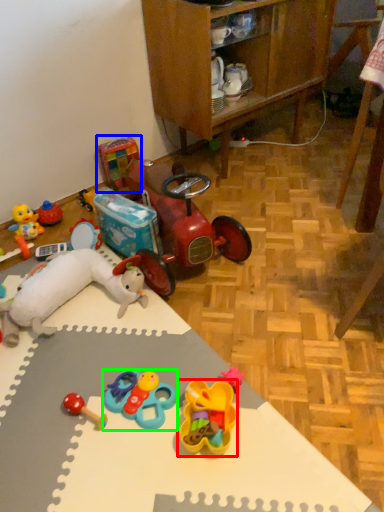
Question: Considering the real-world distances, which object is closest to toy (highlighted by a red box)? toy (highlighted by a blue box) or toy (highlighted by a green box).

Choices:
 (A) toy
 (B) toy

Answer: (B)